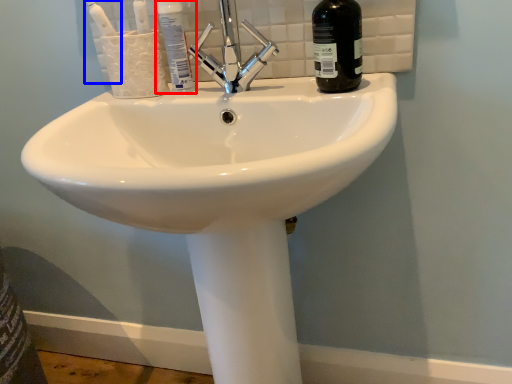
Question: Which of the following is the farthest to the observer, mouthwash (highlighted by a red box) or toothbrush (highlighted by a blue box)?

Choices:
 (A) mouthwash
 (B) toothbrush

Answer: (A)